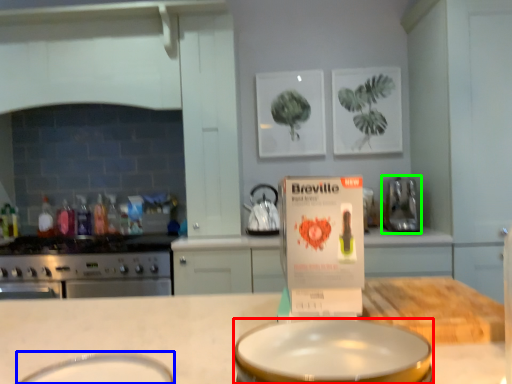
Question: Estimate the real-world distances between objects in this image. Which object is closer to basin (highlighted by a red box), basin (highlighted by a blue box) or kitchen appliance (highlighted by a green box)?

Choices:
 (A) basin
 (B) kitchen appliance

Answer: (A)